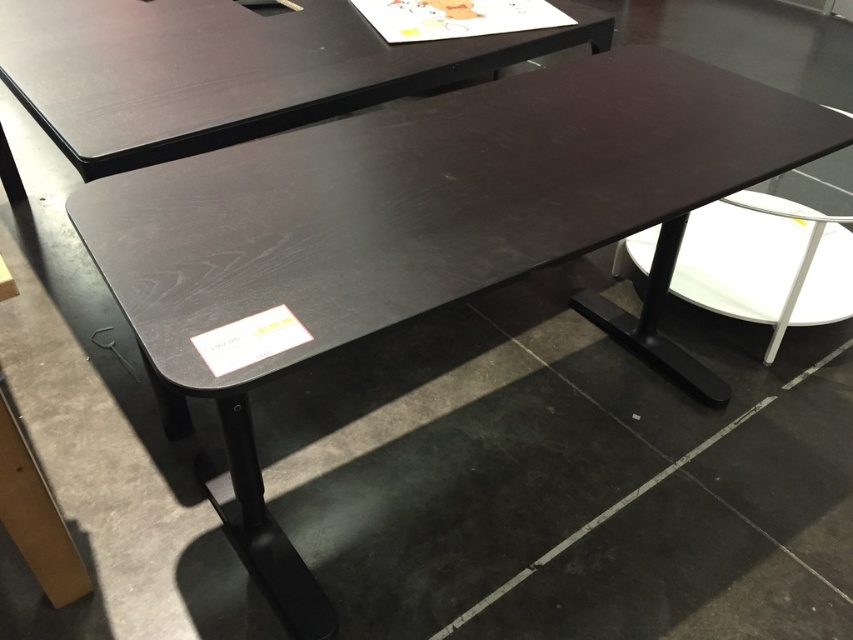
Identify the location of matte black table at upper center. [x=225, y=70].

Who is positioned more to the right, matte black table at upper center or white glossy stool at center?

Positioned to the right is white glossy stool at center.

Who is more forward, (427, 76) or (799, 320)?

Point (427, 76) is in front.

This screenshot has height=640, width=853. Identify the location of matte black table at upper center. (225, 70).